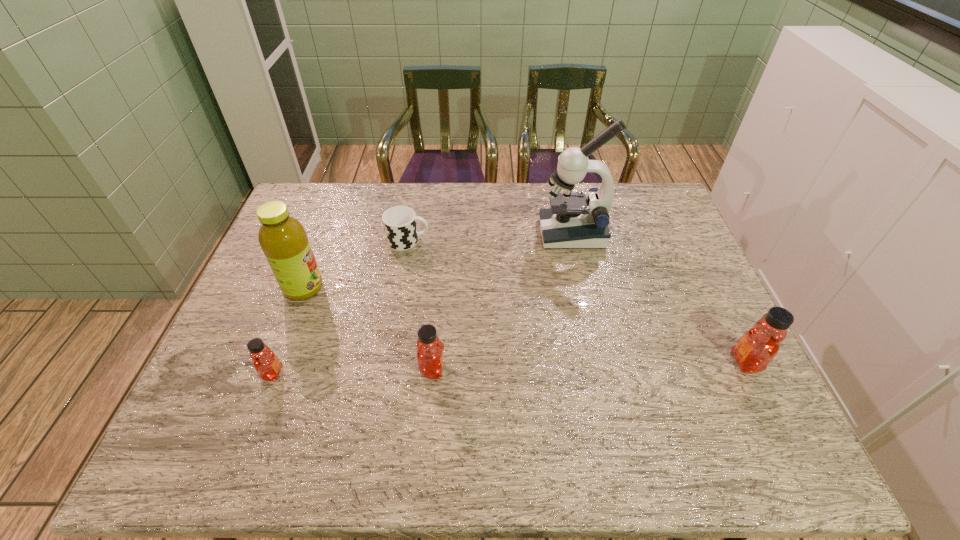
The width and height of the screenshot is (960, 540). I want to click on vacant position for inserting another honey evenly, so click(x=590, y=366).